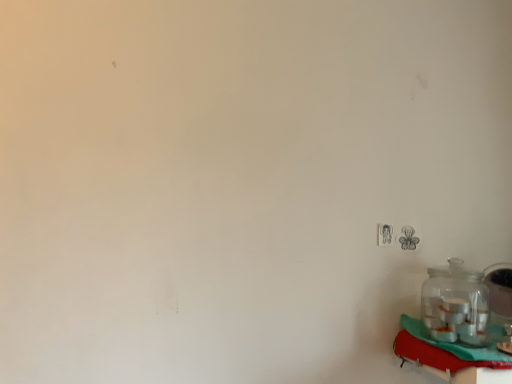
What are the coordinates of `red fabric table at lower right` in the screenshot? It's located at (446, 357).

This screenshot has height=384, width=512. Describe the element at coordinates (446, 357) in the screenshot. I see `red fabric table at lower right` at that location.

This screenshot has height=384, width=512. Describe the element at coordinates (455, 304) in the screenshot. I see `clear glass jar at right` at that location.

Locate an element on the screen. clear glass jar at right is located at coordinates (455, 304).

I want to click on red fabric table at lower right, so click(446, 357).

Based on their positions, is clear glass jar at right located to the left or right of red fabric table at lower right?

Clearly, clear glass jar at right is on the left of red fabric table at lower right in the image.

Considering their positions, is clear glass jar at right located in front of or behind red fabric table at lower right?

In the image, clear glass jar at right appears behind red fabric table at lower right.

Considering the positions of point (485, 287) and point (429, 349), is point (485, 287) closer or farther from the camera than point (429, 349)?

Point (485, 287) is positioned farther from the camera compared to point (429, 349).

From the image's perspective, which is below, clear glass jar at right or red fabric table at lower right?

red fabric table at lower right appears lower in the image.

From a real-world perspective, which object stands above the other?

In real-world perspective, clear glass jar at right is above.

Which of these two, clear glass jar at right or red fabric table at lower right, is thinner?

clear glass jar at right.

From their relative heights in the image, would you say clear glass jar at right is taller or shorter than red fabric table at lower right?

In the image, clear glass jar at right appears to be taller than red fabric table at lower right.

Considering the sizes of objects clear glass jar at right and red fabric table at lower right in the image provided, who is bigger, clear glass jar at right or red fabric table at lower right?

red fabric table at lower right is bigger.

Can red fabric table at lower right be found inside clear glass jar at right?

Definitely not — red fabric table at lower right is not inside clear glass jar at right.

Looking at this image, is there a large distance between clear glass jar at right and red fabric table at lower right?

They are positioned close to each other.

Could you tell me if clear glass jar at right is turned towards red fabric table at lower right?

No.

Can you tell me how much clear glass jar at right and red fabric table at lower right differ in facing direction?

They differ by 2.51 degrees in their facing directions.

How far apart are clear glass jar at right and red fabric table at lower right?

clear glass jar at right is 3.33 inches from red fabric table at lower right.

Identify the location of table that is on the right side of clear glass jar at right. This screenshot has width=512, height=384. (446, 357).

Considering the positions of objects red fabric table at lower right and clear glass jar at right in the image provided, who is more to the left, red fabric table at lower right or clear glass jar at right?

From the viewer's perspective, clear glass jar at right appears more on the left side.

Looking at this image, who is more distant, red fabric table at lower right or clear glass jar at right?

clear glass jar at right is more distant.

Between point (437, 375) and point (462, 303), which one is positioned behind?

The point (462, 303) is farther.

From the image's perspective, is red fabric table at lower right located beneath clear glass jar at right?

Indeed, from the image's perspective, red fabric table at lower right is shown beneath clear glass jar at right.

From a real-world perspective, who is located lower, red fabric table at lower right or clear glass jar at right?

In real-world perspective, red fabric table at lower right is lower.

Between red fabric table at lower right and clear glass jar at right, which one has smaller width?

Thinner between the two is clear glass jar at right.

Between red fabric table at lower right and clear glass jar at right, which one has less height?

red fabric table at lower right is shorter.

Is red fabric table at lower right bigger than clear glass jar at right?

Indeed, red fabric table at lower right has a larger size compared to clear glass jar at right.

Is clear glass jar at right inside red fabric table at lower right?

No, red fabric table at lower right does not contain clear glass jar at right.

Are red fabric table at lower right and clear glass jar at right beside each other?

Yes, red fabric table at lower right is beside clear glass jar at right.

Could you tell me if red fabric table at lower right is turned towards clear glass jar at right?

No, red fabric table at lower right is not oriented towards clear glass jar at right.

Can you tell me how much red fabric table at lower right and clear glass jar at right differ in facing direction?

They differ by 2.51 degrees in their facing directions.

Find the location of a particular element. This screenshot has width=512, height=384. bottle on the left of the red fabric table at lower right is located at coordinates (455, 304).

Locate an element on the screen. This screenshot has height=384, width=512. table lying on the right of clear glass jar at right is located at coordinates (446, 357).

Where is `bottle on the left of the red fabric table at lower right`? The width and height of the screenshot is (512, 384). bottle on the left of the red fabric table at lower right is located at coordinates (455, 304).